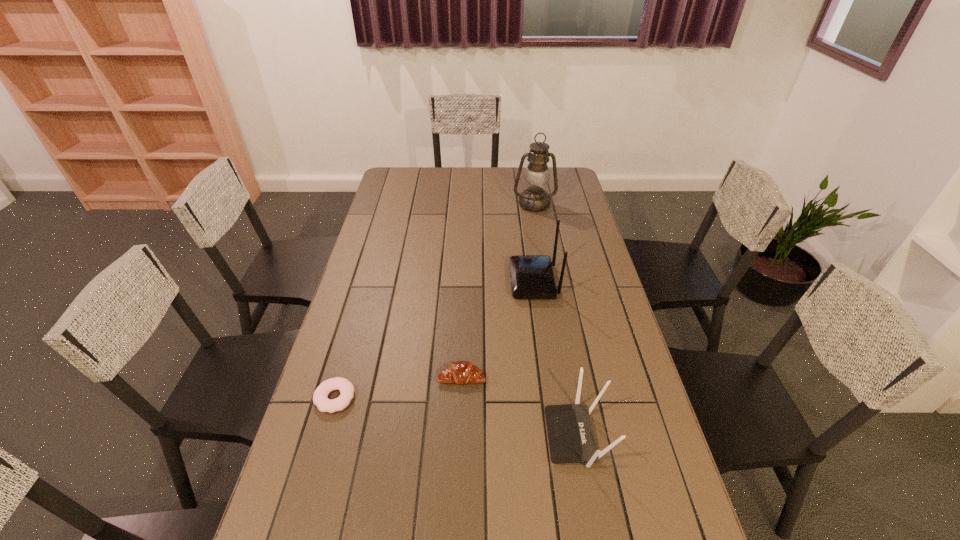
I want to click on the farthest object, so pos(536,177).

The width and height of the screenshot is (960, 540). I want to click on the tallest object, so click(536, 177).

This screenshot has height=540, width=960. I want to click on the farther router, so click(532, 277).

The image size is (960, 540). Identify the location of the fourth nearest object. (532, 277).

Image resolution: width=960 pixels, height=540 pixels. I want to click on the nearer router, so click(571, 440).

Locate an element on the screen. The height and width of the screenshot is (540, 960). the shorter router is located at coordinates (571, 440).

This screenshot has width=960, height=540. Find the location of `crescent roll`. crescent roll is located at coordinates (459, 372).

You are a GUI agent. You are given a task and a screenshot of the screen. Output one action in this format:
    pyautogui.click(x=<x>, y=<y>)
    Task: Click on the fourth object from right to left
    The image size is (960, 540).
    Given the screenshot: What is the action you would take?
    pyautogui.click(x=459, y=372)

At what (x,y) coordinates should I click in order to perform the action: click on the leftmost object. Please return your answer as a coordinate pair (x, y). Looking at the image, I should click on click(x=346, y=388).

Identify the location of doughnut. Image resolution: width=960 pixels, height=540 pixels. (346, 388).